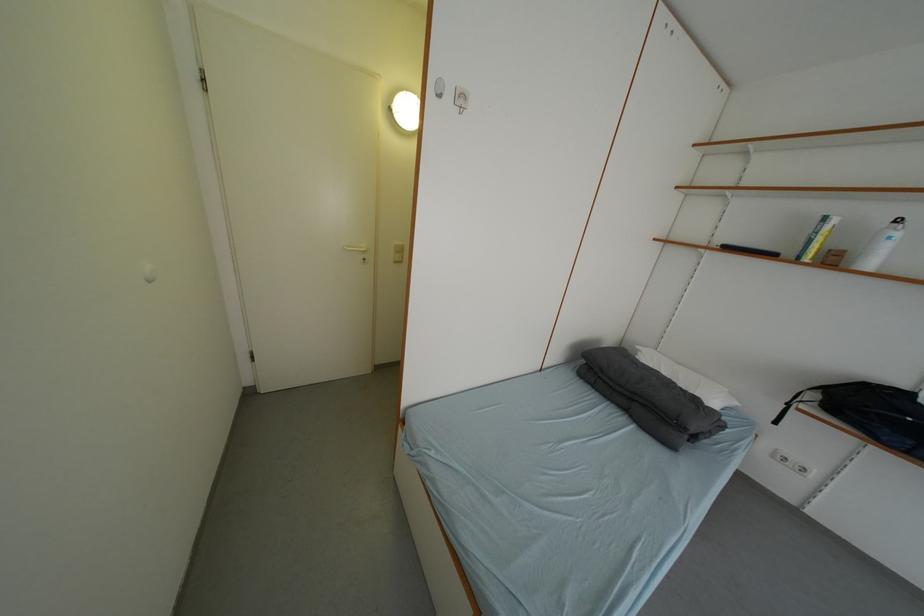
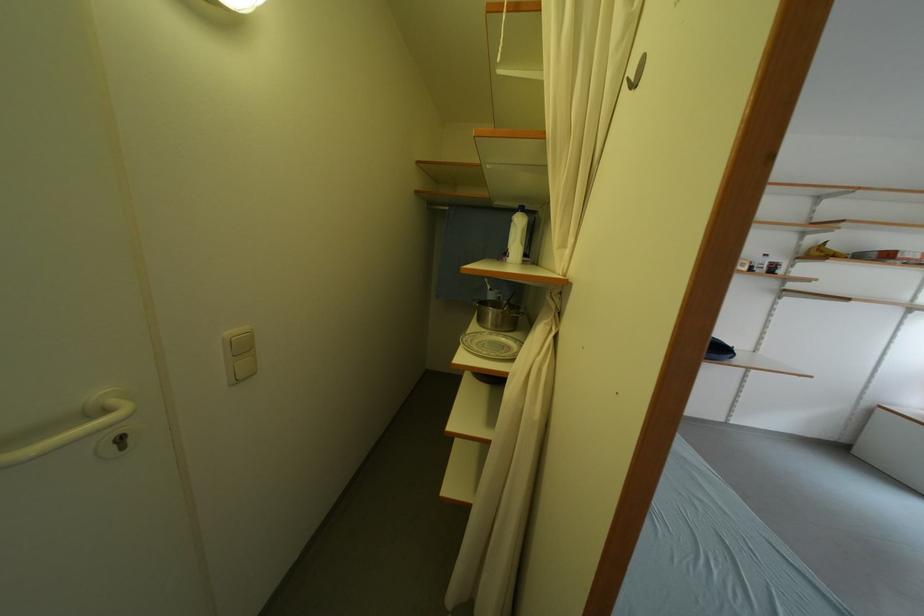
Locate, in the second image, the point that corresponds to the point at 405,246 in the first image.

(237, 336)